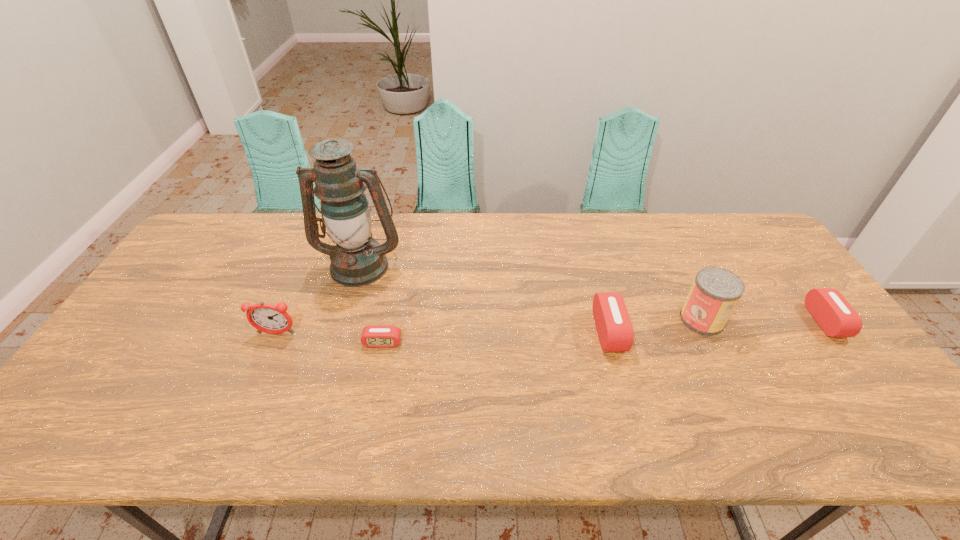
Identify the location of empty location between the third tallest alarm clock and the second object from right to left. Image resolution: width=960 pixels, height=540 pixels. (763, 320).

Identify the location of free space between the oil lamp and the tallest alarm clock. (319, 299).

I want to click on free space between the third alarm clock from right to left and the leftmost alarm clock, so pos(329,338).

Identify which object is located as the fourth nearest to the farthest object. Please provide its 2D coordinates. Your answer should be formatted as a tuple, i.e. [(x, y)], where the tuple contains the x and y coordinates of a point satisfying the conditions above.

[(715, 292)]

Point out which object is positioned as the third nearest to the third object from right to left. Please provide its 2D coordinates. Your answer should be formatted as a tuple, i.e. [(x, y)], where the tuple contains the x and y coordinates of a point satisfying the conditions above.

[(837, 318)]

Locate an element on the screen. the third closest alarm clock to the second alarm clock from left to right is located at coordinates (837, 318).

The width and height of the screenshot is (960, 540). I want to click on alarm clock that stands as the closest to the fourth object from left to right, so click(x=373, y=336).

You are a GUI agent. You are given a task and a screenshot of the screen. Output one action in this format:
    pyautogui.click(x=<x>, y=<y>)
    Task: Click on the free space that satisfies the following two spatial constraints: 1. on the front side of the second object from right to left; 2. on the front-facing side of the fourth object from left to right
    
    Given the screenshot: What is the action you would take?
    pyautogui.click(x=708, y=332)

Identify the location of free point that satisfies the following two spatial constraints: 1. on the front-facing side of the rightmost alarm clock; 2. on the front-facing side of the shortest object. (842, 342).